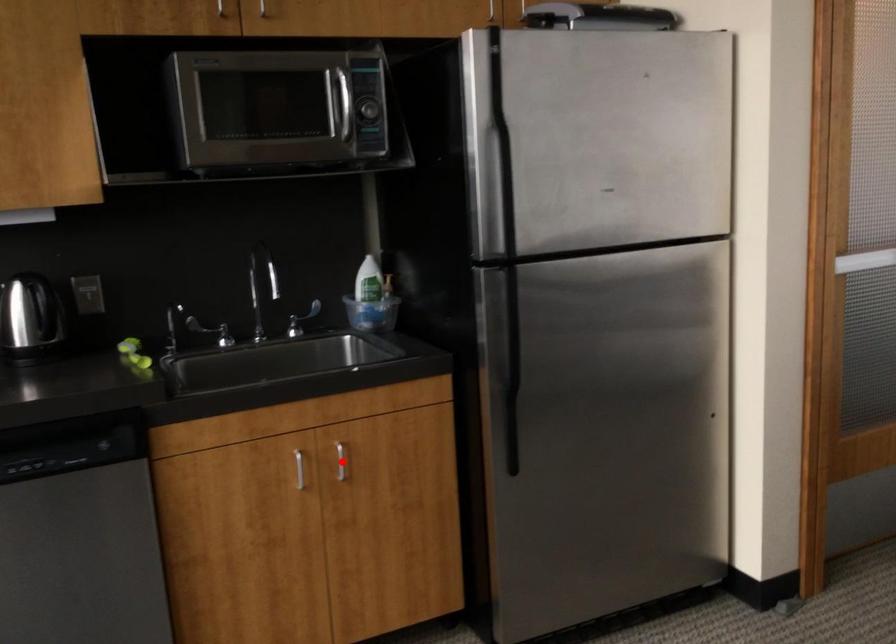
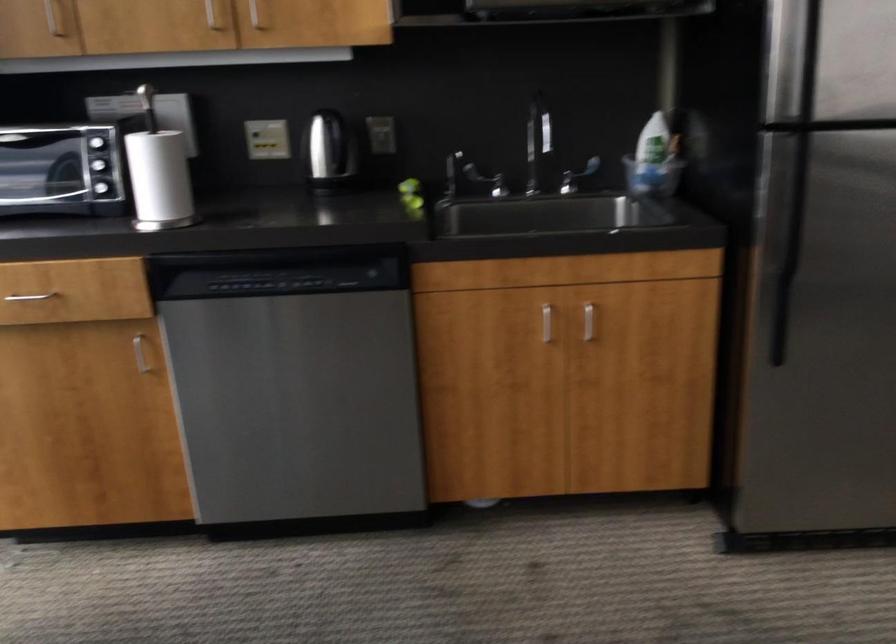
Locate, in the second image, the point that corresponds to the highlighted location in the first image.

(588, 321)